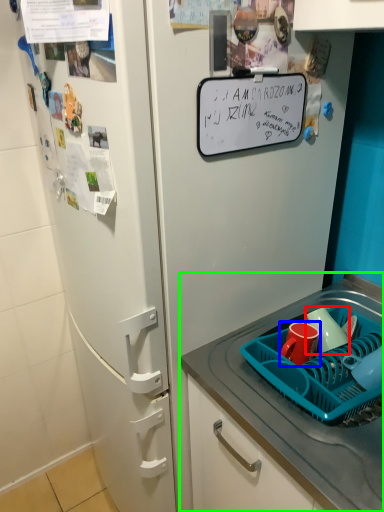
Question: Estimate the real-world distances between objects in this image. Which object is farther from mug (highlighted by a red box), coffee cup (highlighted by a blue box) or desk (highlighted by a green box)?

Choices:
 (A) coffee cup
 (B) desk

Answer: (B)